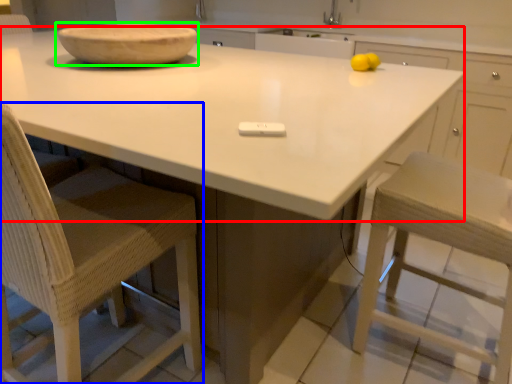
Question: Based on their relative distances, which object is nearer to countertop (highlighted by a red box)? Choose from chair (highlighted by a blue box) and bowl (highlighted by a green box).

Choices:
 (A) chair
 (B) bowl

Answer: (B)